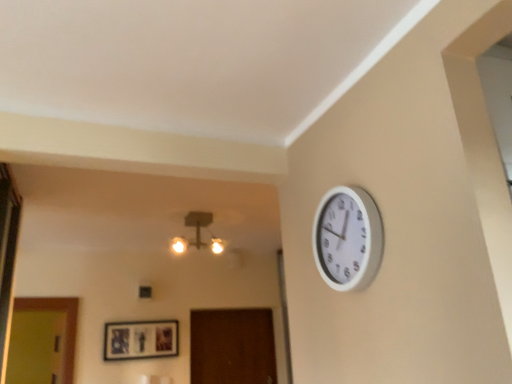
Question: Could you tell me if matte black picture frame at center is turned towards white plastic wall clock at upper right?

Choices:
 (A) no
 (B) yes

Answer: (B)

Question: Would you consider matte black picture frame at center to be distant from white plastic wall clock at upper right?

Choices:
 (A) no
 (B) yes

Answer: (B)

Question: Can white plastic wall clock at upper right be found inside matte black picture frame at center?

Choices:
 (A) yes
 (B) no

Answer: (B)

Question: Is matte black picture frame at center directly adjacent to white plastic wall clock at upper right?

Choices:
 (A) yes
 (B) no

Answer: (B)

Question: Can you confirm if matte black picture frame at center is thinner than white plastic wall clock at upper right?

Choices:
 (A) no
 (B) yes

Answer: (B)

Question: From a real-world perspective, is matte glass chandelier at upper center above or below white plastic wall clock at upper right?

Choices:
 (A) above
 (B) below

Answer: (A)

Question: Considering the positions of point (195, 223) and point (371, 266), is point (195, 223) closer or farther from the camera than point (371, 266)?

Choices:
 (A) farther
 (B) closer

Answer: (A)

Question: From the image's perspective, is matte glass chandelier at upper center positioned above or below white plastic wall clock at upper right?

Choices:
 (A) below
 (B) above

Answer: (A)

Question: In terms of height, does matte glass chandelier at upper center look taller or shorter compared to white plastic wall clock at upper right?

Choices:
 (A) tall
 (B) short

Answer: (B)

Question: Is white plastic wall clock at upper right inside or outside of matte black picture frame at center?

Choices:
 (A) inside
 (B) outside

Answer: (B)

Question: Is white plastic wall clock at upper right bigger or smaller than matte black picture frame at center?

Choices:
 (A) big
 (B) small

Answer: (B)

Question: From the image's perspective, is white plastic wall clock at upper right located above or below matte black picture frame at center?

Choices:
 (A) below
 (B) above

Answer: (B)

Question: Is white plastic wall clock at upper right to the left or to the right of matte black picture frame at center in the image?

Choices:
 (A) right
 (B) left

Answer: (A)

Question: Considering the positions of matte black picture frame at center and white plastic wall clock at upper right in the image, is matte black picture frame at center wider or thinner than white plastic wall clock at upper right?

Choices:
 (A) wide
 (B) thin

Answer: (B)

Question: From the image's perspective, relative to white plastic wall clock at upper right, is matte black picture frame at center above or below?

Choices:
 (A) above
 (B) below

Answer: (B)